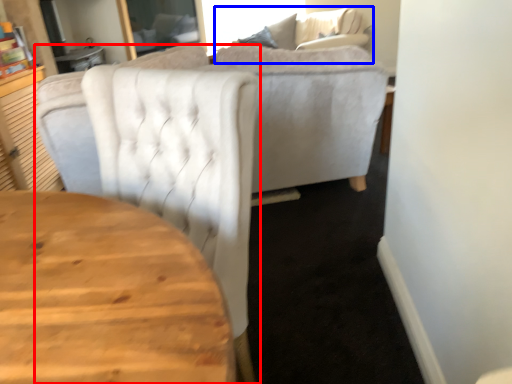
Question: Which object appears farthest to the camera in this image, chair (highlighted by a red box) or couch (highlighted by a blue box)?

Choices:
 (A) chair
 (B) couch

Answer: (B)